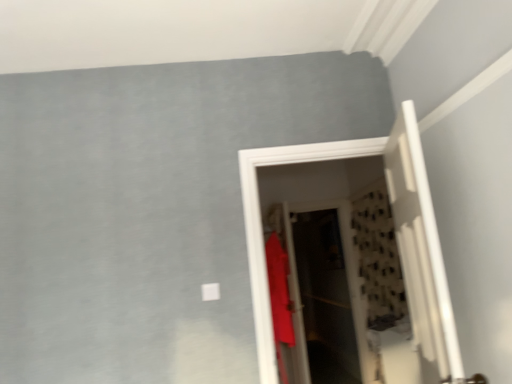
Question: Based on their sizes in the image, would you say matte red shirt at center is bigger or smaller than white wooden door at right, the 2th door viewed from the back?

Choices:
 (A) small
 (B) big

Answer: (B)

Question: From a real-world perspective, is matte red shirt at center above or below white wooden door at right, the 2th door viewed from the back?

Choices:
 (A) above
 (B) below

Answer: (B)

Question: Which is farther from the white wooden door at right, positioned as the first door in front-to-back order?

Choices:
 (A) matte white door at center, marked as the first door in a back-to-front arrangement
 (B) matte red shirt at center
 (C) translucent plastic screen door at center

Answer: (C)

Question: Estimate the real-world distances between objects in this image. Which object is farther from the matte red shirt at center?

Choices:
 (A) translucent plastic screen door at center
 (B) white wooden door at right, the 2th door viewed from the back
 (C) matte white door at center, marked as the first door in a back-to-front arrangement

Answer: (B)